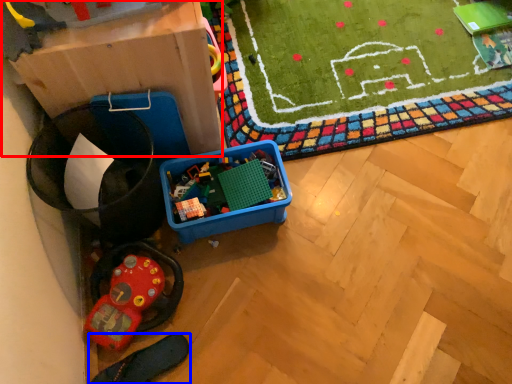
Question: Which of the following is the farthest to the observer, cardboard box (highlighted by a red box) or footwear (highlighted by a blue box)?

Choices:
 (A) cardboard box
 (B) footwear

Answer: (B)